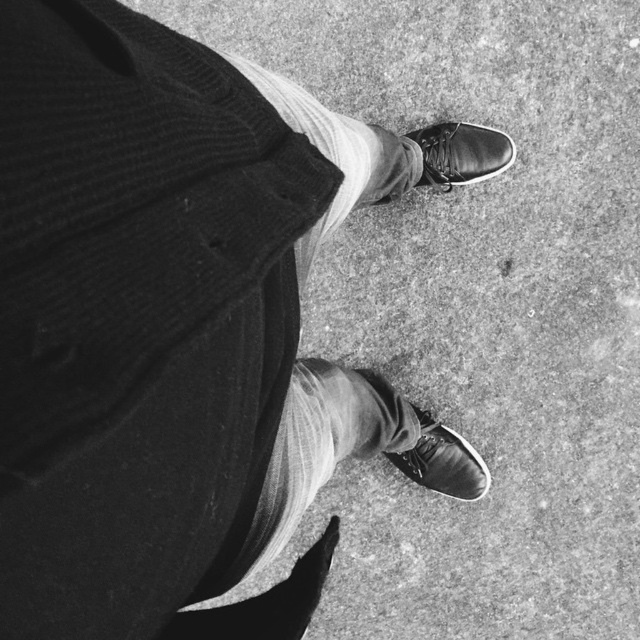
In the scene shown: You are looking down at the person in the image. Which shoe, the shiny leather shoe at center or the shiny black shoe at center, is positioned closer to you?

The shiny leather shoe at center is closer to the viewer than the shiny black shoe at center.

You are a tailor observing a person wearing shiny leather shoe at center and shiny black shoe at center. You need to place both shoes side by side on a shelf. Which shoe should you place first to ensure they fit properly?

You should place the shiny leather shoe at center first because it is wider than the shiny black shoe at center, allowing the narrower shoe to fit alongside without overcrowding.